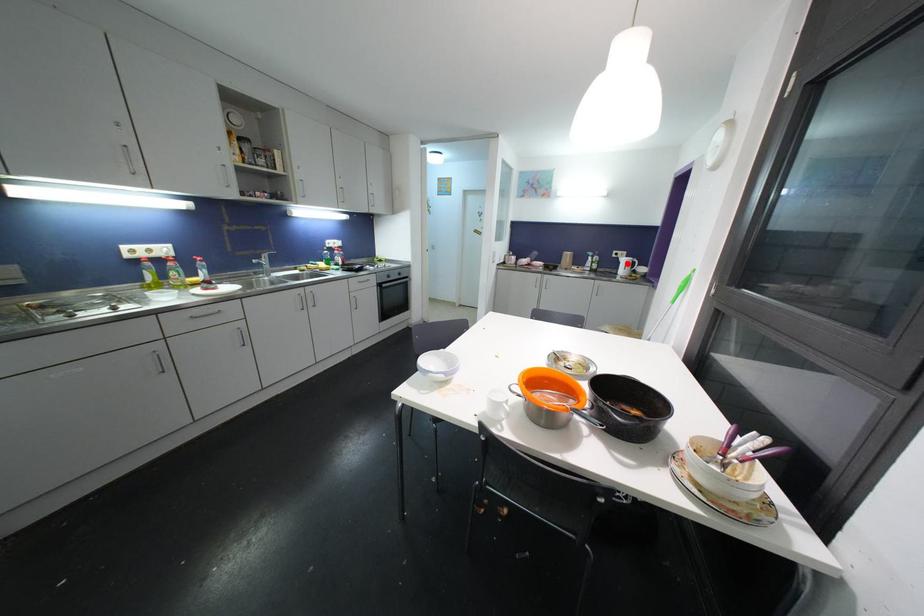
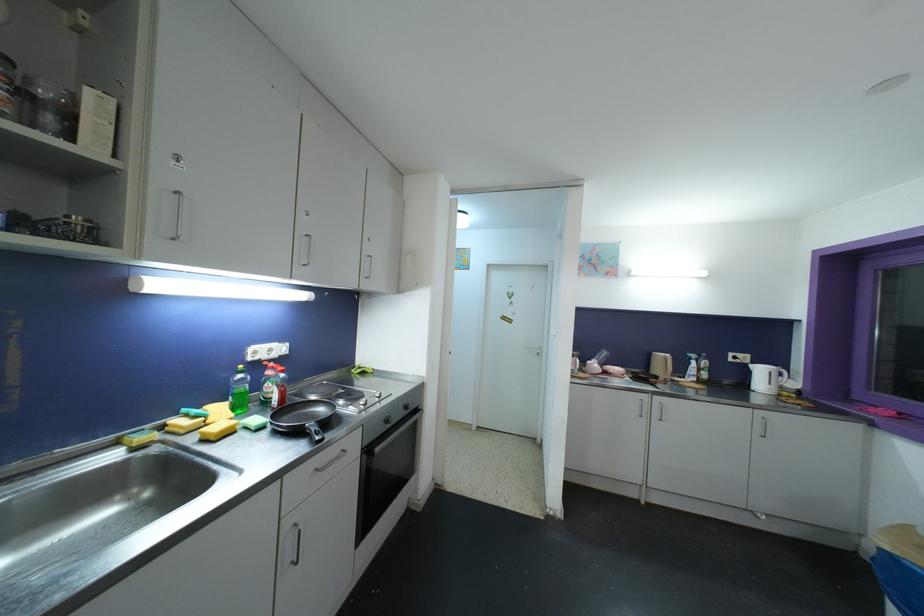
Locate, in the second image, the point that corresponds to the highlighted location in the first image.

(763, 373)